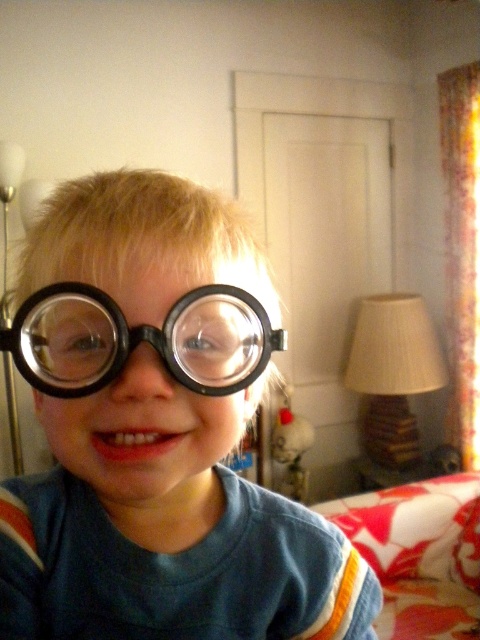
The child is wearing two items on their head. Which one is positioned lower between the matte black glasses at center and the black matte goggles at center?

The matte black glasses at center is positioned lower than the black matte goggles at center.

You are a child who wants to wear both the matte black glasses at center and the black matte goggles at center. Which one should you put on first to ensure the other fits properly?

You should put on the matte black glasses at center first because it is larger in size than the black matte goggles at center, so the goggles can be placed over the glasses without being obstructed.